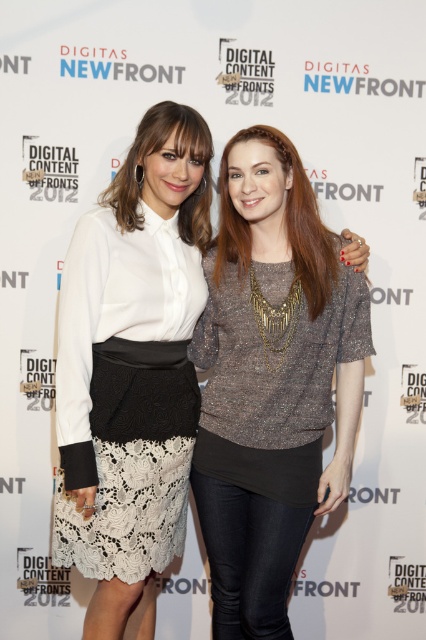
Is sparkly metallic top at center closer to camera compared to white lace skirt at center?

No.

Is sparkly metallic top at center thinner than white lace skirt at center?

In fact, sparkly metallic top at center might be wider than white lace skirt at center.

Measure the distance between sparkly metallic top at center and camera.

They are 5.59 feet apart.

Locate an element on the screen. The height and width of the screenshot is (640, 426). sparkly metallic top at center is located at coordinates (270, 381).